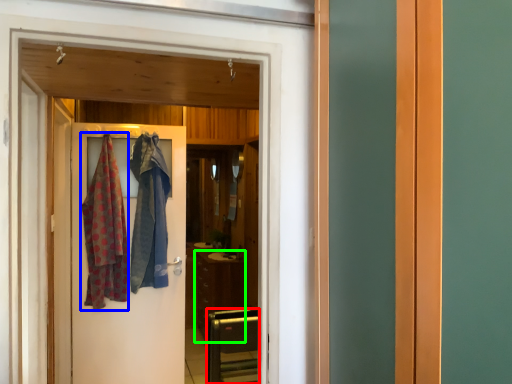
Question: Which object is the closest to the furniture (highlighted by a red box)? Choose among these: clothing (highlighted by a blue box) or cabinetry (highlighted by a green box).

Choices:
 (A) clothing
 (B) cabinetry

Answer: (A)